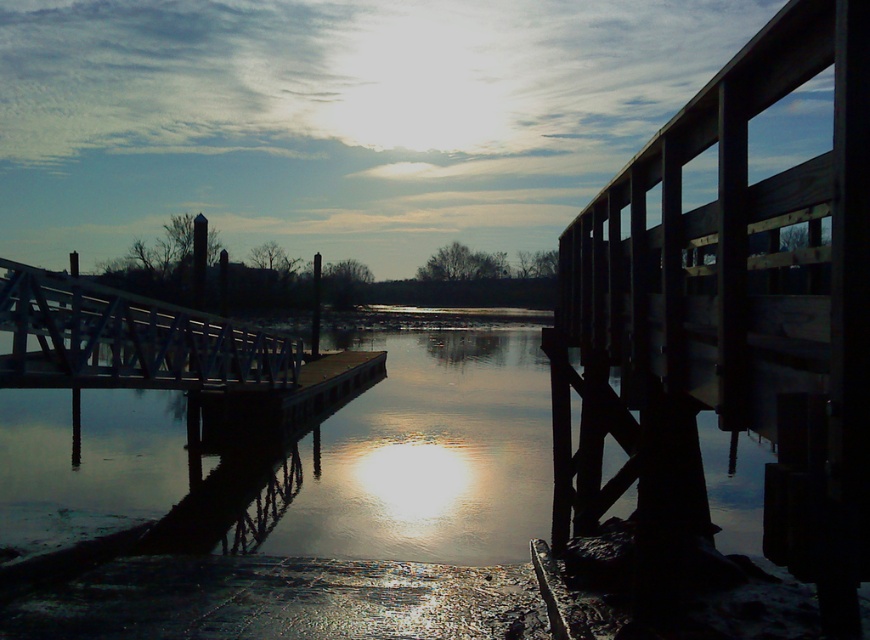
Which is more to the left, wooden rail at right or white metal bridge at left?

A: Positioned to the left is white metal bridge at left.

Does point (730, 195) come behind point (242, 342)?

No.

Find the location of a particular element. This screenshot has height=640, width=870. wooden rail at right is located at coordinates (733, 305).